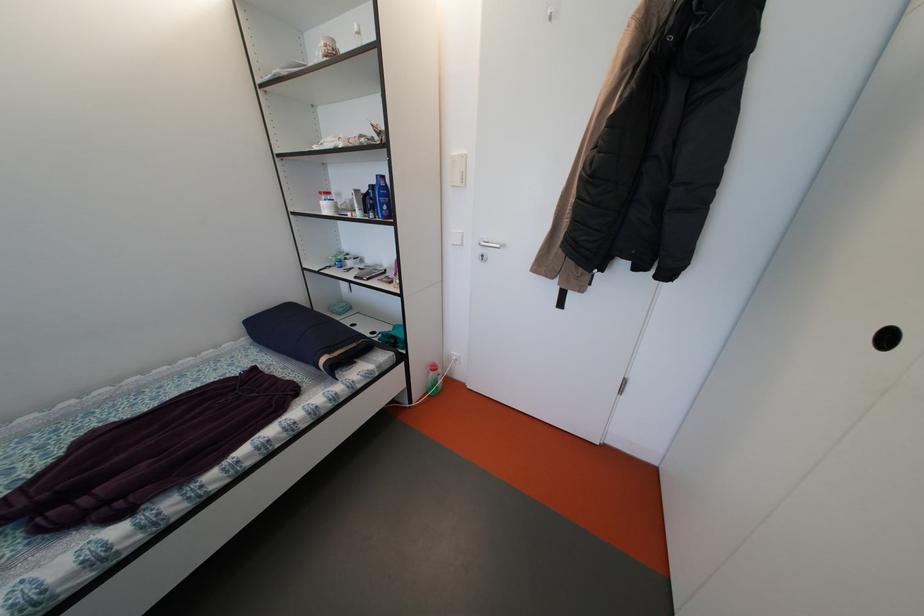
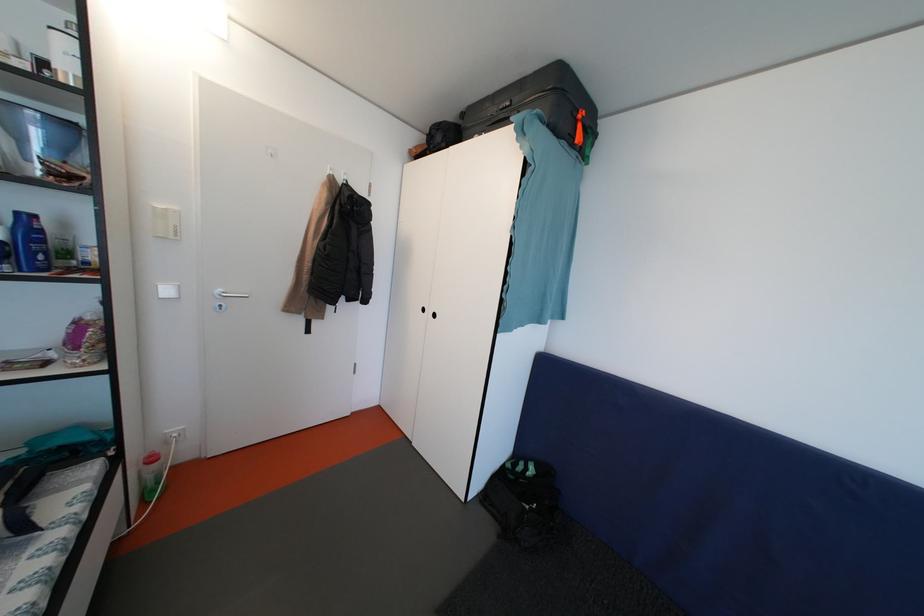
Where in the second image is the point corresponding to [393,213] from the first image?

(49, 262)